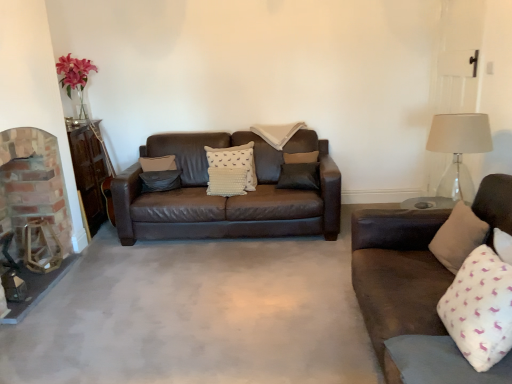
Looking at this image, measure the distance between point (460, 174) and camera.

The distance of point (460, 174) from camera is 3.75 meters.

Locate an element on the screen. The height and width of the screenshot is (384, 512). matte gray pillow at center, the fifth pillow viewed from the right is located at coordinates (160, 180).

Locate an element on the screen. brick fireplace at left is located at coordinates (34, 213).

What do you see at coordinates (234, 161) in the screenshot?
I see `white textured pillow at center, which ranks as the 2th pillow in left-to-right order` at bounding box center [234, 161].

Identify the location of white textured pillow at center, marked as the 3th pillow in a front-to-back arrangement. The image size is (512, 384). (234, 161).

Measure the distance between point (467, 294) and camera.

1.69 meters.

Where is `translucent glass table lamp at right`? The width and height of the screenshot is (512, 384). translucent glass table lamp at right is located at coordinates (459, 149).

Is translucent glass table lamp at right taller or shorter than white textured pillow at center, which ranks as the 2th pillow in left-to-right order?

Considering their sizes, translucent glass table lamp at right has more height than white textured pillow at center, which ranks as the 2th pillow in left-to-right order.

Does translucent glass table lamp at right have a smaller size compared to white textured pillow at center, marked as the 3th pillow in a front-to-back arrangement?

Incorrect, translucent glass table lamp at right is not smaller in size than white textured pillow at center, marked as the 3th pillow in a front-to-back arrangement.

Is translucent glass table lamp at right not close to white textured pillow at center, the third pillow positioned from the back?

Indeed, translucent glass table lamp at right is not near white textured pillow at center, the third pillow positioned from the back.

Does point (462, 173) come closer to viewer compared to point (218, 155)?

No.

Is brick fireplace at left positioned far away from white soft pillow at right, which appears as the fifth pillow when viewed from the back?

Yes, brick fireplace at left and white soft pillow at right, which appears as the fifth pillow when viewed from the back, are located far from each other.

How different are the orientations of brick fireplace at left and white soft pillow at right, the 1th pillow in the front-to-back sequence, in degrees?

They differ by 161 degrees in their facing directions.

From a real-world perspective, is brick fireplace at left physically located above or below white soft pillow at right, which is counted as the fourth pillow, starting from the left?

From a real-world perspective, brick fireplace at left is physically above white soft pillow at right, which is counted as the fourth pillow, starting from the left.

Between brick fireplace at left and white soft pillow at right, the 1th pillow in the front-to-back sequence, which one has more height?

brick fireplace at left is taller.

How far apart are brick fireplace at left and beige fabric pillow at right, the fourth pillow in the back-to-front sequence?

brick fireplace at left is 8.92 feet from beige fabric pillow at right, the fourth pillow in the back-to-front sequence.

Can you confirm if brick fireplace at left is smaller than beige fabric pillow at right, which is the 1th pillow from right to left?

Actually, brick fireplace at left might be larger than beige fabric pillow at right, which is the 1th pillow from right to left.

Does brick fireplace at left turn towards beige fabric pillow at right, the fourth pillow in the back-to-front sequence?

Yes, brick fireplace at left is turned towards beige fabric pillow at right, the fourth pillow in the back-to-front sequence.

Does brick fireplace at left have a greater width compared to beige fabric pillow at right, which ranks as the 2th pillow in front-to-back order?

Indeed, brick fireplace at left has a greater width compared to beige fabric pillow at right, which ranks as the 2th pillow in front-to-back order.

From a real-world perspective, is beige fabric pillow at right, which is the fifth pillow in left-to-right order, located higher than white textured pillow at center, marked as the 3th pillow in a front-to-back arrangement?

Incorrect, from a real-world perspective, beige fabric pillow at right, which is the fifth pillow in left-to-right order, is lower than white textured pillow at center, marked as the 3th pillow in a front-to-back arrangement.

Which is farther from the camera, [459,258] or [210,148]?

The point [210,148] is farther.

Is beige fabric pillow at right, which ranks as the 2th pillow in front-to-back order, facing towards white textured pillow at center, marked as the 3th pillow in a front-to-back arrangement?

No, beige fabric pillow at right, which ranks as the 2th pillow in front-to-back order, is not turned towards white textured pillow at center, marked as the 3th pillow in a front-to-back arrangement.

Is beige fabric pillow at right, which is the fifth pillow in left-to-right order, touching white textured pillow at center, which ranks as the 2th pillow in left-to-right order?

No, beige fabric pillow at right, which is the fifth pillow in left-to-right order, is not next to white textured pillow at center, which ranks as the 2th pillow in left-to-right order.

The height and width of the screenshot is (384, 512). What are the coordinates of `the 2nd pillow above the brick fireplace at left (from the image's perspective)` in the screenshot? It's located at (234, 161).

Does brick fireplace at left lie in front of white textured pillow at center, which ranks as the 2th pillow in left-to-right order?

Yes, brick fireplace at left is in front of white textured pillow at center, which ranks as the 2th pillow in left-to-right order.

Considering the relative sizes of brick fireplace at left and white textured pillow at center, which ranks as the 2th pillow in left-to-right order, in the image provided, is brick fireplace at left bigger than white textured pillow at center, which ranks as the 2th pillow in left-to-right order,?

Yes.

Between beige fabric pillow at right, the fourth pillow in the back-to-front sequence, and brick fireplace at left, which one is positioned in front?

beige fabric pillow at right, the fourth pillow in the back-to-front sequence, is in front.

From a real-world perspective, is beige fabric pillow at right, which is the fifth pillow in left-to-right order, physically above brick fireplace at left?

Incorrect, from a real-world perspective, beige fabric pillow at right, which is the fifth pillow in left-to-right order, is lower than brick fireplace at left.

Looking at this image, can you confirm if beige fabric pillow at right, which is the fifth pillow in left-to-right order, is positioned to the right of brick fireplace at left?

Correct, you'll find beige fabric pillow at right, which is the fifth pillow in left-to-right order, to the right of brick fireplace at left.

Between white textured pillow at center, the fourth pillow positioned from the right, and beige fabric pillow at center, acting as the 5th pillow starting from the front, which one has smaller size?

With smaller size is white textured pillow at center, the fourth pillow positioned from the right.

Looking at their sizes, would you say white textured pillow at center, the third pillow positioned from the back, is wider or thinner than beige fabric pillow at center, acting as the 5th pillow starting from the front?

Clearly, white textured pillow at center, the third pillow positioned from the back, has less width compared to beige fabric pillow at center, acting as the 5th pillow starting from the front.

From a real-world perspective, is white textured pillow at center, the fourth pillow positioned from the right, positioned over beige fabric pillow at center, placed as the third pillow when sorted from right to left, based on gravity?

No.

Does white textured pillow at center, the third pillow positioned from the back, turn towards beige fabric pillow at center, the first pillow from the back?

No, white textured pillow at center, the third pillow positioned from the back, is not oriented towards beige fabric pillow at center, the first pillow from the back.

This screenshot has width=512, height=384. Find the location of `table lamp in front of the white textured pillow at center, the fourth pillow positioned from the right`. table lamp in front of the white textured pillow at center, the fourth pillow positioned from the right is located at coordinates (459, 149).

What are the coordinates of `the 2nd pillow positioned below the brick fireplace at left (from the image's perspective)` in the screenshot? It's located at (480, 308).

Consider the image. When comparing their distances from beige fabric pillow at center, placed as the third pillow when sorted from right to left, does brick fireplace at left or translucent glass table lamp at right seem further?

The object further to beige fabric pillow at center, placed as the third pillow when sorted from right to left, is brick fireplace at left.

Looking at the image, which one is located further to beige fabric pillow at center, the first pillow from the back, white soft pillow at right, which is counted as the fourth pillow, starting from the left, or matte gray pillow at center, arranged as the 1th pillow when viewed from the left?

Among the two, white soft pillow at right, which is counted as the fourth pillow, starting from the left, is located further to beige fabric pillow at center, the first pillow from the back.

Which object lies further to the anchor point beige fabric pillow at right, the fourth pillow in the back-to-front sequence, beige fabric pillow at center, the third pillow positioned from the left, or translucent glass table lamp at right?

Among the two, beige fabric pillow at center, the third pillow positioned from the left, is located further to beige fabric pillow at right, the fourth pillow in the back-to-front sequence.

Estimate the real-world distances between objects in this image. Which object is closer to translucent glass table lamp at right, matte gray pillow at center, the fifth pillow viewed from the right, or beige fabric pillow at center, the third pillow positioned from the left?

beige fabric pillow at center, the third pillow positioned from the left.

Looking at the image, which one is located further to matte gray pillow at center, the 2th pillow positioned from the back, white soft pillow at right, which is counted as the fourth pillow, starting from the left, or beige fabric pillow at right, the fourth pillow in the back-to-front sequence?

Based on the image, white soft pillow at right, which is counted as the fourth pillow, starting from the left, appears to be further to matte gray pillow at center, the 2th pillow positioned from the back.

Looking at the image, which one is located closer to brick fireplace at left, matte gray pillow at center, the 4th pillow in the front-to-back sequence, or white soft pillow at right, which ranks as the second pillow in right-to-left order?

Based on the image, matte gray pillow at center, the 4th pillow in the front-to-back sequence, appears to be nearer to brick fireplace at left.

Estimate the real-world distances between objects in this image. Which object is further from translucent glass table lamp at right, beige fabric pillow at right, which is the fifth pillow in left-to-right order, or brick fireplace at left?

brick fireplace at left is positioned further to the anchor translucent glass table lamp at right.

Considering their positions, is brick fireplace at left positioned closer to matte gray pillow at center, the fifth pillow viewed from the right, than beige fabric pillow at center, the first pillow from the back?

Among the two, brick fireplace at left is located nearer to matte gray pillow at center, the fifth pillow viewed from the right.

Where is `table lamp located between white soft pillow at right, which ranks as the second pillow in right-to-left order, and beige fabric pillow at center, acting as the 5th pillow starting from the front, in the depth direction`? Image resolution: width=512 pixels, height=384 pixels. table lamp located between white soft pillow at right, which ranks as the second pillow in right-to-left order, and beige fabric pillow at center, acting as the 5th pillow starting from the front, in the depth direction is located at coordinates (459, 149).

Locate an element on the screen. Image resolution: width=512 pixels, height=384 pixels. table lamp between beige fabric pillow at right, which is the 1th pillow from right to left, and beige fabric pillow at center, the first pillow from the back, from front to back is located at coordinates (459, 149).

This screenshot has width=512, height=384. Find the location of `pillow between white soft pillow at right, the 1th pillow in the front-to-back sequence, and translucent glass table lamp at right from front to back`. pillow between white soft pillow at right, the 1th pillow in the front-to-back sequence, and translucent glass table lamp at right from front to back is located at coordinates (458, 237).

Where is `pillow located between brick fireplace at left and matte gray pillow at center, the 2th pillow positioned from the back, in the depth direction`? pillow located between brick fireplace at left and matte gray pillow at center, the 2th pillow positioned from the back, in the depth direction is located at coordinates tap(234, 161).